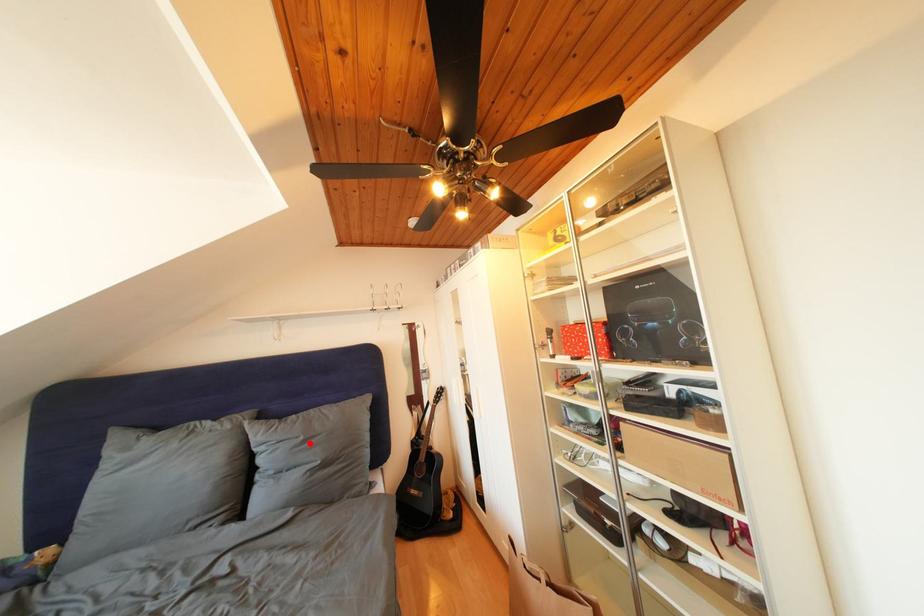
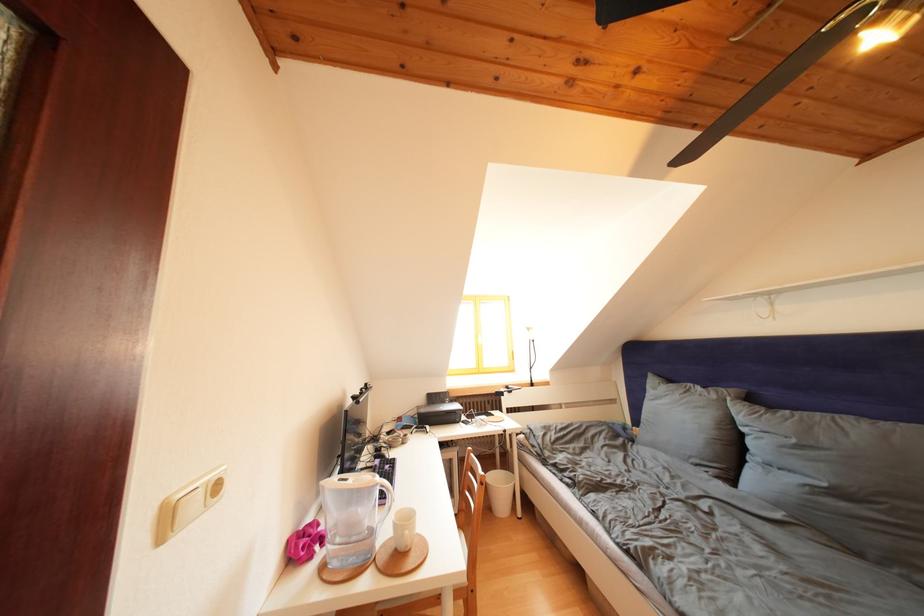
The point at the highlighted location is marked in the first image. Where is the corresponding point in the second image?

(801, 446)